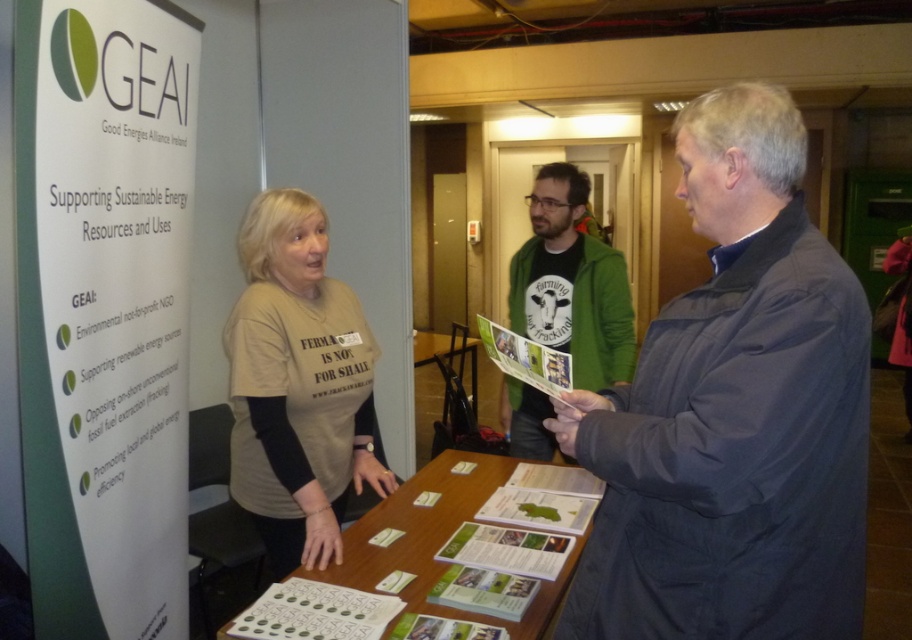
Does beige t-shirt at center have a lesser height compared to green fuzzy sweater at center?

Indeed, beige t-shirt at center has a lesser height compared to green fuzzy sweater at center.

Is beige t-shirt at center behind green fuzzy sweater at center?

That is False.

Locate an element on the screen. This screenshot has height=640, width=912. beige t-shirt at center is located at coordinates (297, 385).

At what (x,y) coordinates should I click in order to perform the action: click on beige t-shirt at center. Please return your answer as a coordinate pair (x, y). Looking at the image, I should click on (297, 385).

Does green fuzzy sweater at center have a lesser height compared to wooden table at center?

In fact, green fuzzy sweater at center may be taller than wooden table at center.

Is green fuzzy sweater at center in front of wooden table at center?

Yes, green fuzzy sweater at center is in front of wooden table at center.

Which is behind, point (575, 298) or point (452, 333)?

Point (452, 333)

The height and width of the screenshot is (640, 912). Identify the location of green fuzzy sweater at center. (571, 284).

Who is positioned more to the right, dark blue jacket at center or green paper at center?

Positioned to the right is dark blue jacket at center.

Is dark blue jacket at center further to the viewer compared to green paper at center?

No, dark blue jacket at center is closer to the viewer.

Is point (847, 276) more distant than point (361, 544)?

No, (847, 276) is in front of (361, 544).

You are a GUI agent. You are given a task and a screenshot of the screen. Output one action in this format:
    pyautogui.click(x=<x>, y=<y>)
    Task: Click on the dark blue jacket at center
    This screenshot has height=640, width=912.
    Given the screenshot: What is the action you would take?
    pyautogui.click(x=733, y=413)